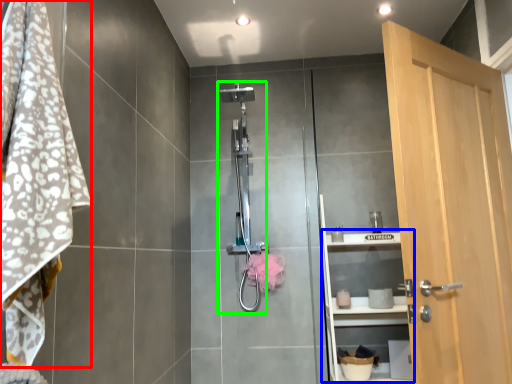
Question: Which is nearer to the bath towel (highlighted by a red box)? shelf (highlighted by a blue box) or shower (highlighted by a green box).

Choices:
 (A) shelf
 (B) shower

Answer: (B)